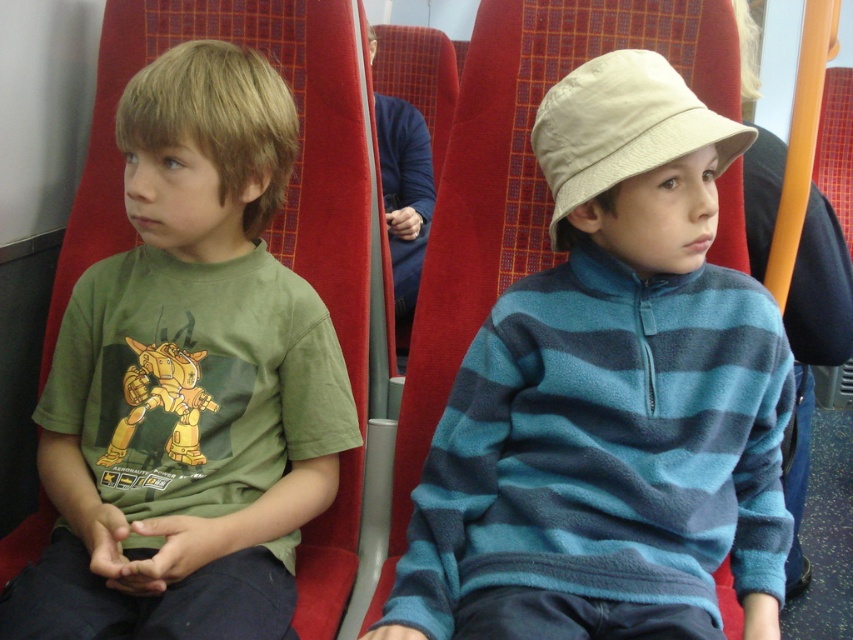
Question: Can you confirm if green cotton shirt at left is bigger than beige fabric hat at center?

Choices:
 (A) yes
 (B) no

Answer: (A)

Question: Which is farther from the green cotton shirt at left?

Choices:
 (A) beige fabric hat at center
 (B) blue striped fleece at center

Answer: (A)

Question: Among these objects, which one is farthest from the camera?

Choices:
 (A) blue striped fleece at center
 (B) green cotton shirt at left
 (C) beige fabric hat at center

Answer: (C)

Question: Considering the relative positions of green cotton shirt at left and beige fabric hat at center in the image provided, where is green cotton shirt at left located with respect to beige fabric hat at center?

Choices:
 (A) above
 (B) below

Answer: (B)

Question: Which of the following is the farthest from the observer?

Choices:
 (A) green cotton shirt at left
 (B) beige fabric hat at center
 (C) blue striped fleece at center

Answer: (B)

Question: Can you confirm if green cotton shirt at left is positioned below beige fabric hat at center?

Choices:
 (A) no
 (B) yes

Answer: (B)